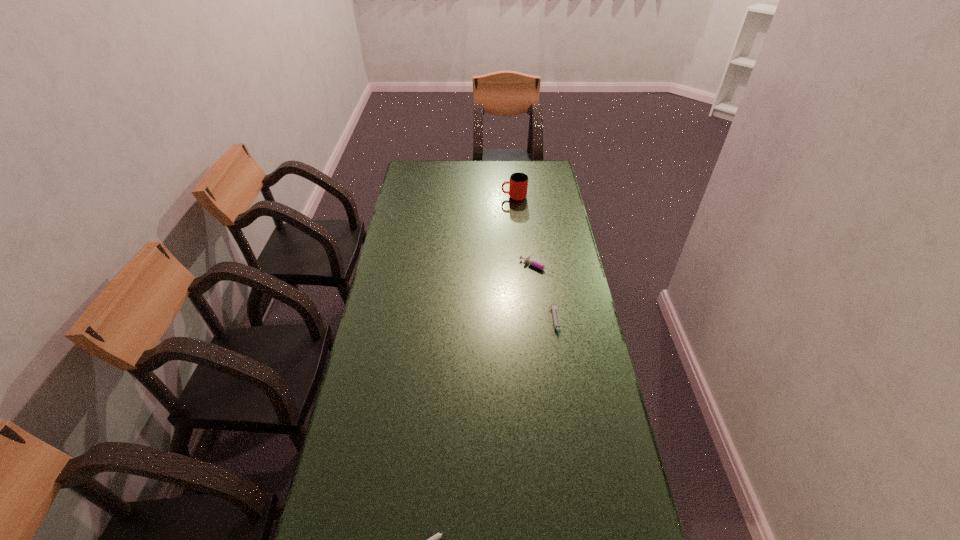
The height and width of the screenshot is (540, 960). Identify the location of free region located at the needle end of the second shortest object. (574, 432).

The width and height of the screenshot is (960, 540). I want to click on cup present at the right edge, so click(518, 182).

Where is `free space at the far edge of the desktop`? The width and height of the screenshot is (960, 540). free space at the far edge of the desktop is located at coordinates (441, 174).

The height and width of the screenshot is (540, 960). In order to click on blank area at the left edge in this screenshot , I will do `click(400, 229)`.

Image resolution: width=960 pixels, height=540 pixels. Identify the location of free space at the right edge. (616, 526).

You are a GUI agent. You are given a task and a screenshot of the screen. Output one action in this format:
    pyautogui.click(x=<x>, y=<y>)
    Task: Click on the free space at the far left corner of the desktop
    
    Given the screenshot: What is the action you would take?
    pos(406,183)

You are a GUI agent. You are given a task and a screenshot of the screen. Output one action in this format:
    pyautogui.click(x=<x>, y=<y>)
    Task: Click on the blank space at the far right corner
    This screenshot has width=960, height=540.
    Given the screenshot: What is the action you would take?
    pyautogui.click(x=549, y=166)

Locate an element on the screen. The width and height of the screenshot is (960, 540). vacant space that is in between the third nearest object and the third farthest object is located at coordinates (547, 296).

Find the location of a particular element. This screenshot has height=540, width=960. free space that is in between the farthest syringe and the third tallest object is located at coordinates pos(547,296).

The image size is (960, 540). In order to click on vacant area that lies between the second farthest object and the farthest object in this screenshot , I will do `click(526, 232)`.